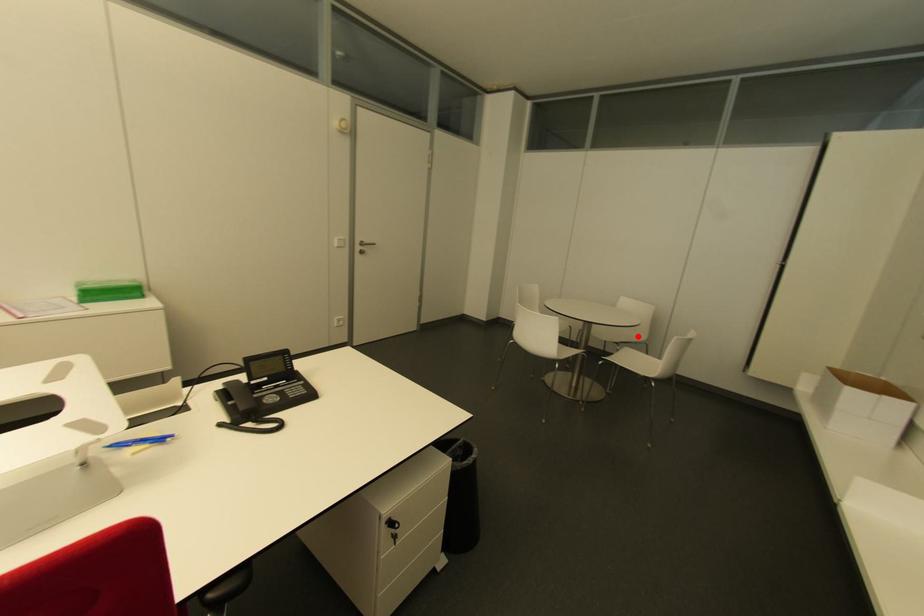
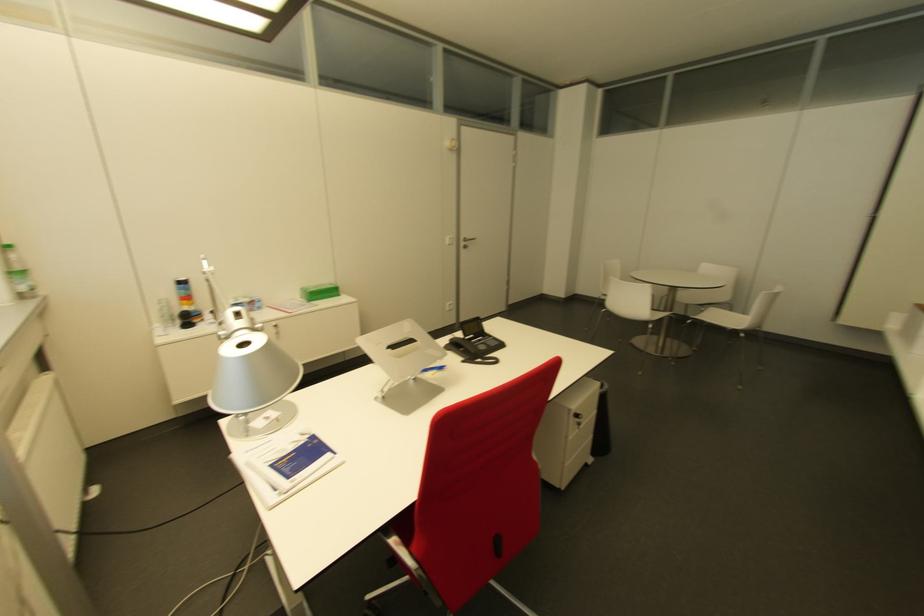
In the second image, find the point that corresponds to the highlighted location in the first image.

(722, 298)